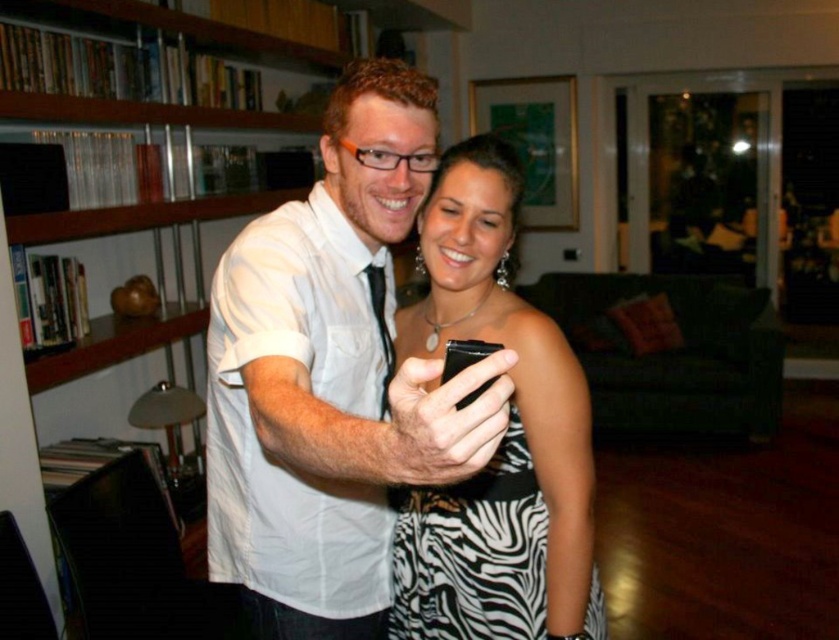
Looking at this image, is white matte shirt at center smaller than zebra print dress at center?

No, white matte shirt at center is not smaller than zebra print dress at center.

Who is lower down, white matte shirt at center or zebra print dress at center?

zebra print dress at center is lower down.

Which is behind, point (259, 397) or point (477, 291)?

The point (477, 291) is more distant.

Locate an element on the screen. The height and width of the screenshot is (640, 839). white matte shirt at center is located at coordinates (331, 376).

Is point (303, 620) more distant than point (462, 364)?

That is True.

Describe the element at coordinates (320, 372) in the screenshot. I see `wooden bookshelf at upper left` at that location.

I want to click on wooden bookshelf at upper left, so click(320, 372).

In the scene shown: Which is above, zebra print dress at center or black matte smartphone at center?

Positioned higher is black matte smartphone at center.

Between zebra print dress at center and black matte smartphone at center, which one appears on the right side from the viewer's perspective?

zebra print dress at center

Which is in front, point (477, 541) or point (477, 358)?

Positioned in front is point (477, 358).

The image size is (839, 640). I want to click on zebra print dress at center, so click(501, 440).